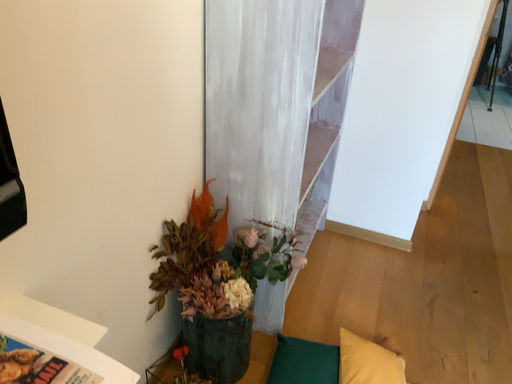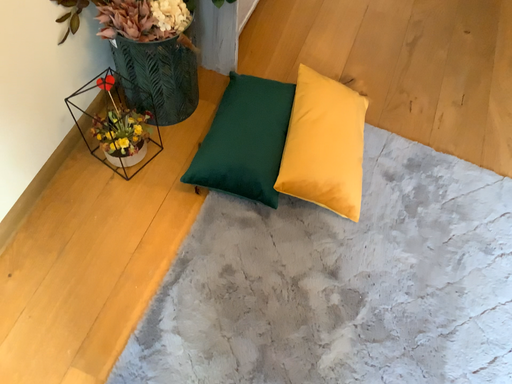
Question: How did the camera likely rotate when shooting the video?

Choices:
 (A) rotated downward
 (B) rotated upward

Answer: (A)